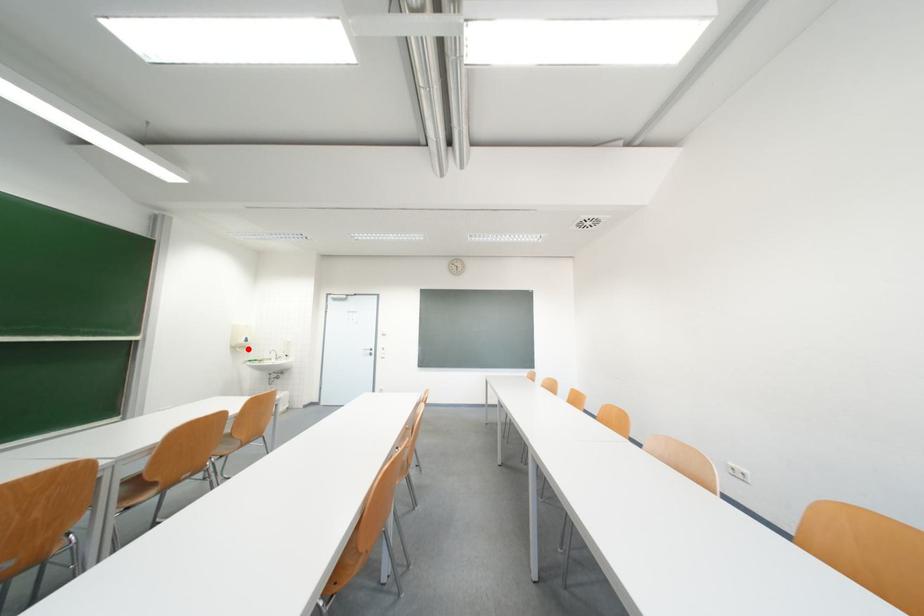
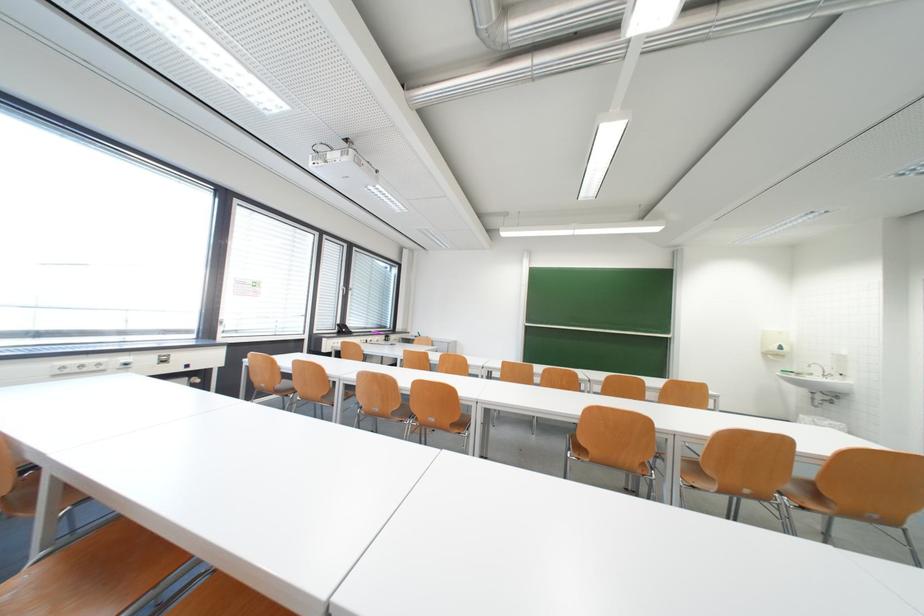
Question: I am providing you with two images of the same scene from different viewpoints. A red point is shown in image1. For the corresponding object point in image2, is it positioned nearer or farther from the camera?

Choices:
 (A) Nearer
 (B) Farther

Answer: (B)